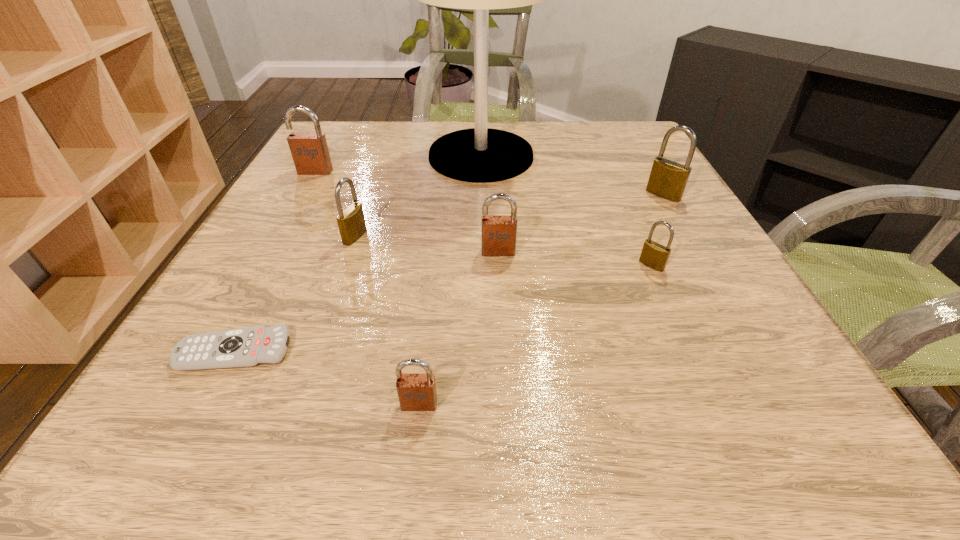
You are a GUI agent. You are given a task and a screenshot of the screen. Output one action in this format:
    pyautogui.click(x=<x>, y=<y>)
    Task: Click on the fifth padlock from left to right
    
    Given the screenshot: What is the action you would take?
    pyautogui.click(x=654, y=255)

I want to click on the sixth farthest object, so click(654, 255).

Locate an element on the screen. the smallest brown padlock is located at coordinates (416, 392).

You are a GUI agent. You are given a task and a screenshot of the screen. Output one action in this format:
    pyautogui.click(x=<x>, y=<y>)
    Task: Click on the second brown padlock from right to left
    
    Given the screenshot: What is the action you would take?
    pyautogui.click(x=416, y=392)

Find the location of a particular element. The image size is (960, 540). remote control is located at coordinates (251, 346).

Find the location of a particular element. the seventh farthest object is located at coordinates (251, 346).

This screenshot has height=540, width=960. I want to click on vacant position located 0.300m on the right of the tallest object, so click(659, 156).

At what (x,y) coordinates should I click in order to perform the action: click on vacant space situated 0.160m on the left of the rightmost object. Please return your answer as a coordinate pair (x, y). Looking at the image, I should click on (572, 195).

Identify the location of free space located 0.220m on the front-facing side of the farthest padlock. (280, 233).

Locate an element on the screen. This screenshot has height=540, width=960. free space located 0.070m on the front of the sixth object from right to left is located at coordinates (343, 272).